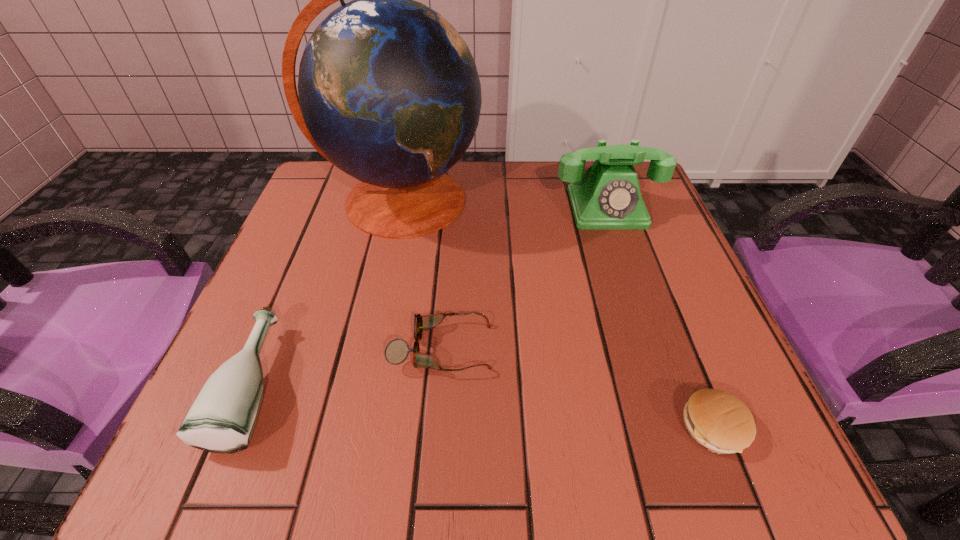
The image size is (960, 540). In order to click on vacant point located between the second tallest object and the patty in this screenshot , I will do `click(660, 318)`.

Image resolution: width=960 pixels, height=540 pixels. I want to click on free area in between the patty and the tallest object, so click(x=557, y=314).

The image size is (960, 540). I want to click on free space between the fourth shortest object and the spectacles, so click(x=524, y=278).

Identify the location of vacant space that is in between the tallest object and the patty. (557, 314).

Where is `blank region between the telephone and the patty`? blank region between the telephone and the patty is located at coordinates (660, 318).

I want to click on vacant space that is in between the bottle and the spectacles, so click(348, 367).

Locate which object ranks second in proximity to the fourth shortest object. Please provide its 2D coordinates. Your answer should be formatted as a tuple, i.e. [(x, y)], where the tuple contains the x and y coordinates of a point satisfying the conditions above.

[(396, 352)]

The image size is (960, 540). I want to click on object that ranks as the closest to the third tallest object, so click(396, 352).

I want to click on vacant space that satisfies the following two spatial constraints: 1. on the dial of the telephone; 2. on the front-facing side of the spectacles, so coord(655,348).

This screenshot has height=540, width=960. I want to click on free space in the image that satisfies the following two spatial constraints: 1. on the dial of the fourth shortest object; 2. on the front-facing side of the spectacles, so click(655, 348).